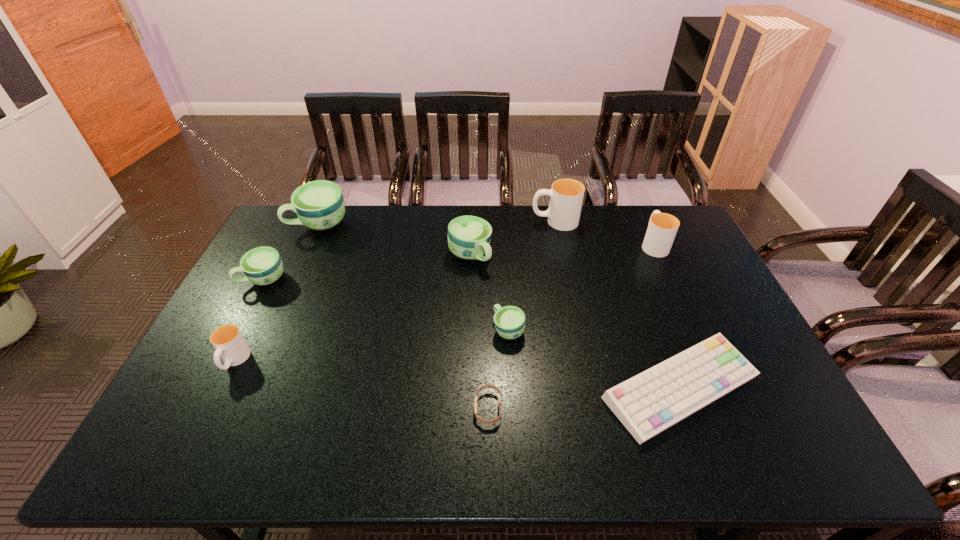
Identify the location of the nearest blue cup. The image size is (960, 540). (509, 321).

Where is `white computer keyboard`? white computer keyboard is located at coordinates (647, 404).

The image size is (960, 540). Find the location of `computer keyboard`. computer keyboard is located at coordinates (647, 404).

Where is `the shortest object`? This screenshot has height=540, width=960. the shortest object is located at coordinates pos(495,420).

The width and height of the screenshot is (960, 540). Find the location of `watch`. watch is located at coordinates (495, 420).

Where is `vacant space located 0.330m with the handle on the side of the second yellow cup from right to left`? The image size is (960, 540). vacant space located 0.330m with the handle on the side of the second yellow cup from right to left is located at coordinates (444, 221).

What are the coordinates of `vacant space located with the handle on the side of the second yellow cup from right to left` in the screenshot? It's located at (454, 221).

Where is `vacant space situated with the handle on the side of the second yellow cup from right to left`? This screenshot has height=540, width=960. vacant space situated with the handle on the side of the second yellow cup from right to left is located at coordinates (493, 221).

Find the location of a particular element. The height and width of the screenshot is (540, 960). vacant space located 0.330m on the front of the biggest blue cup is located at coordinates (283, 305).

Identify the location of free spot located 0.110m with the handle on the side of the rightmost cup. The height and width of the screenshot is (540, 960). (640, 215).